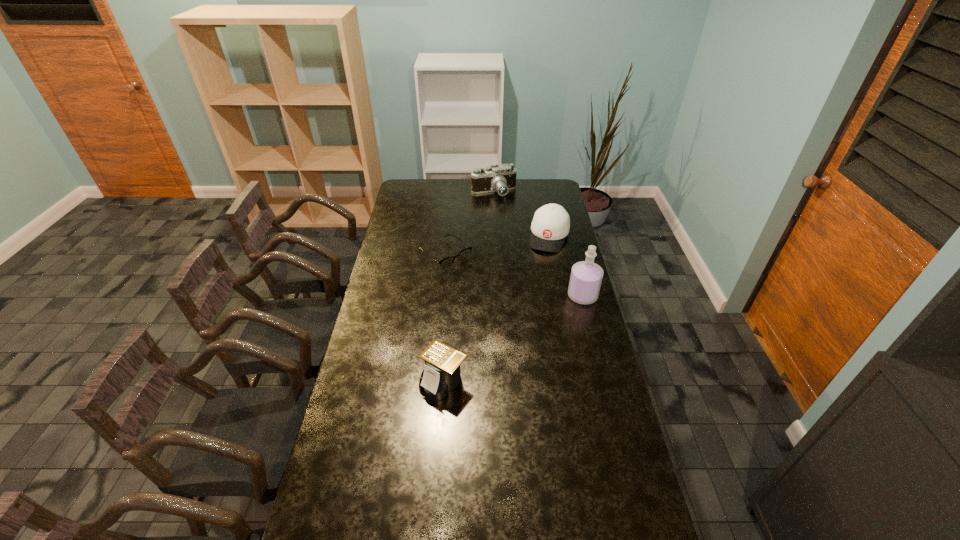
At what (x,y) coordinates should I click in order to perform the action: click on unoccupied position between the spectacles and the calculator. Please return your answer as a coordinate pair (x, y). This screenshot has width=960, height=540. Looking at the image, I should click on (444, 318).

Find the location of `vacant area that lies between the shortest object and the baseball cap`. vacant area that lies between the shortest object and the baseball cap is located at coordinates (497, 246).

The image size is (960, 540). Identify the location of free space between the camera and the shortest object. (469, 224).

Locate an element on the screen. The image size is (960, 540). free space between the farthest object and the shortest object is located at coordinates (469, 224).

This screenshot has width=960, height=540. What are the coordinates of `empty space between the perfume and the nearest object` in the screenshot? It's located at (514, 339).

Identify the location of vacant area that lies between the baseball cap and the farthest object. (521, 214).

Locate which object ranks in proximity to the calculator. Please provide its 2D coordinates. Your answer should be formatted as a tuple, i.e. [(x, y)], where the tuple contains the x and y coordinates of a point satisfying the conditions above.

[(446, 263)]

Identify which object is located as the nearest to the shortest object. Please provide its 2D coordinates. Your answer should be formatted as a tuple, i.e. [(x, y)], where the tuple contains the x and y coordinates of a point satisfying the conditions above.

[(551, 223)]

This screenshot has width=960, height=540. What are the coordinates of `vacant position in the image that satisfies the following two spatial constraints: 1. on the back side of the camera; 2. on the left side of the calculator` in the screenshot? It's located at (458, 193).